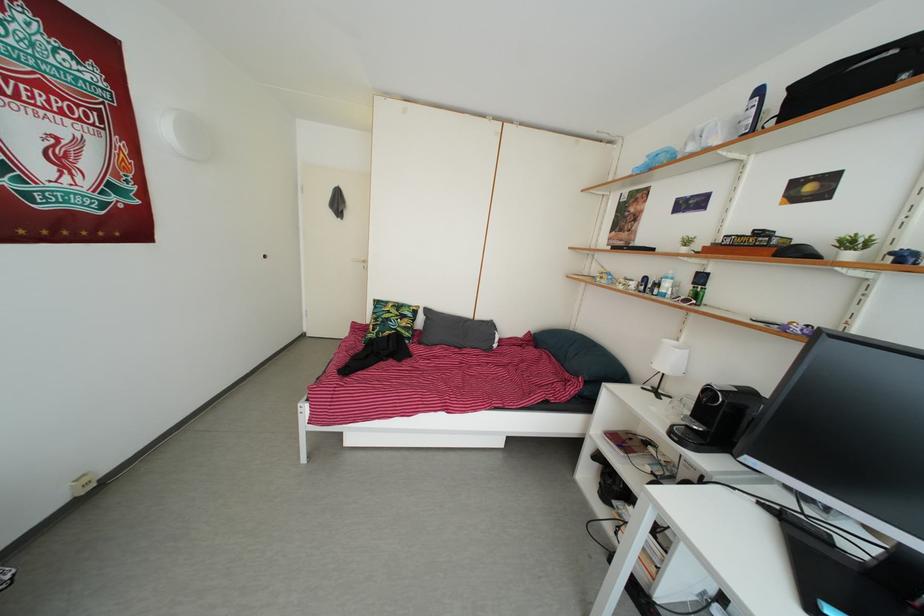
Which object does [630,286] point to?

It corresponds to the white patterned mug in the image.